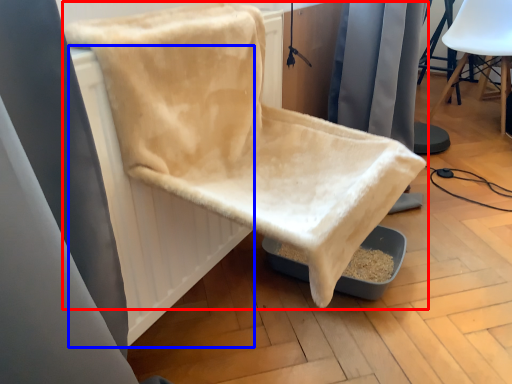
Question: Among these objects, which one is nearest to the camera, chair (highlighted by a red box) or radiator (highlighted by a blue box)?

Choices:
 (A) chair
 (B) radiator

Answer: (A)